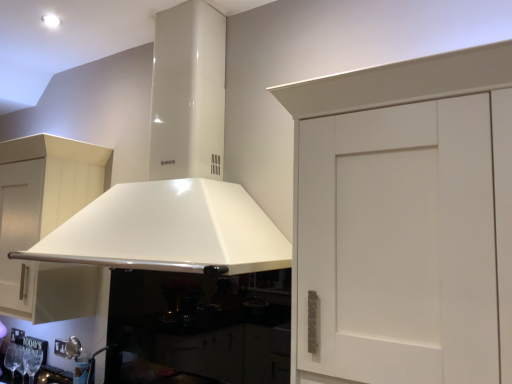
Question: Looking at the image, does white glossy exhaust hood at center seem bigger or smaller compared to matte white cabinet at left?

Choices:
 (A) small
 (B) big

Answer: (B)

Question: From a real-world perspective, is white glossy exhaust hood at center above or below matte white cabinet at left?

Choices:
 (A) below
 (B) above

Answer: (B)

Question: Is point pos(247,241) closer or farther from the camera than point pos(36,180)?

Choices:
 (A) closer
 (B) farther

Answer: (A)

Question: From a real-world perspective, is matte white cabinet at left physically located above or below white glossy exhaust hood at center?

Choices:
 (A) below
 (B) above

Answer: (A)

Question: Is matte white cabinet at left inside the boundaries of white glossy exhaust hood at center, or outside?

Choices:
 (A) outside
 (B) inside

Answer: (A)

Question: From the image's perspective, is matte white cabinet at left located above or below white glossy exhaust hood at center?

Choices:
 (A) below
 (B) above

Answer: (A)

Question: Considering the positions of matte white cabinet at left and white glossy exhaust hood at center in the image, is matte white cabinet at left taller or shorter than white glossy exhaust hood at center?

Choices:
 (A) short
 (B) tall

Answer: (A)